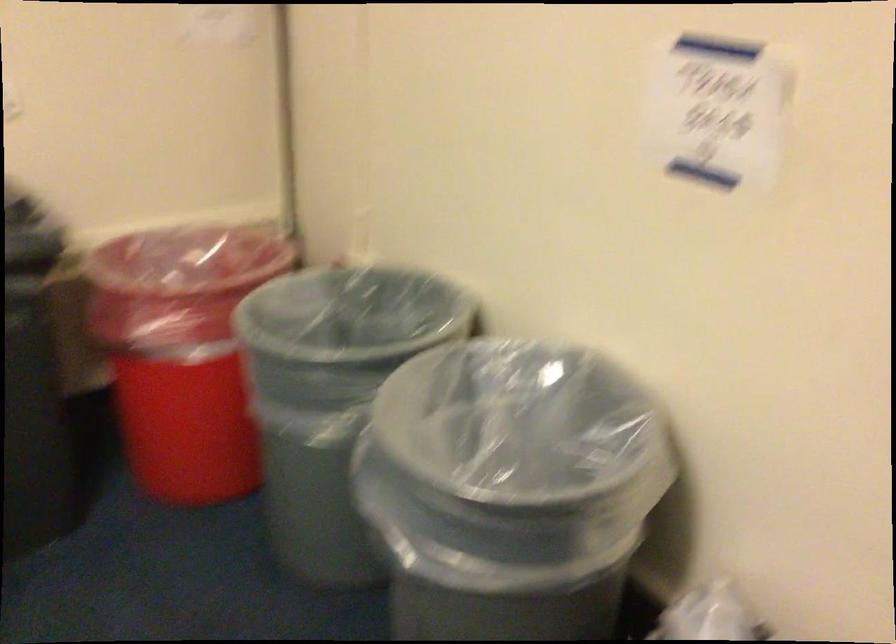
The height and width of the screenshot is (644, 896). What are the coordinates of `plastic trash liner` in the screenshot? It's located at (178, 276).